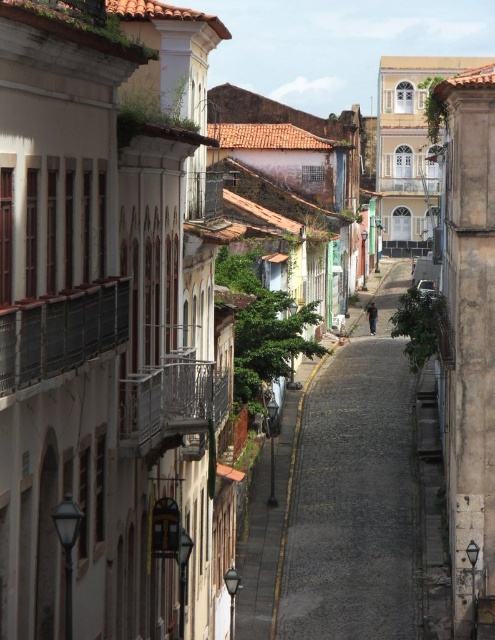
You are standing on the street looking towards the buildings. There are two points marked on the ground in front of you. The first is at point (388, 419) and the second is at point (491, 387). Which point is closer to you?

Point (491, 387) is closer to you because it is nearer to the camera compared to point (388, 419).

You are standing on the cobblestone street at center and want to walk towards the brown stone wall at right. In which direction should you move?

You should move to the right because the cobblestone street at center is to the left of the brown stone wall at right.

You are a delivery person with a cart that is 2 meters wide. You need to move your cart from the cobblestone street at center to the brown stone wall at right. Is there enough space between them for your cart to pass through?

The cobblestone street at center and brown stone wall at right are 20.34 feet apart, which converts to approximately 6.2 meters. Since your cart is 2 meters wide, there is sufficient space for it to pass through the 6.2 meter gap between them.